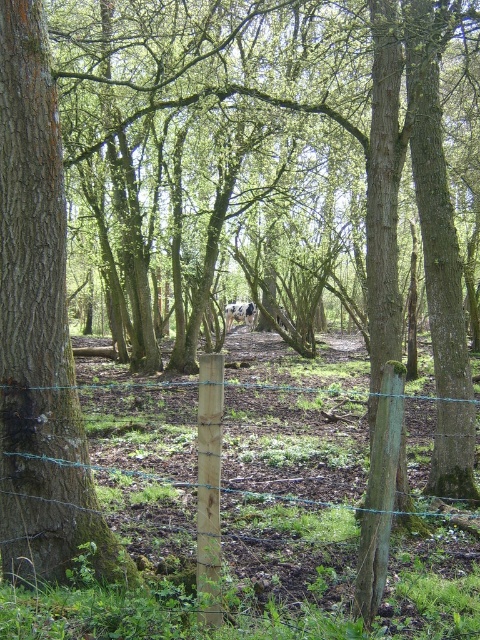
Is green wire fence at center smaller than rough bark tree at center?

Incorrect, green wire fence at center is not smaller in size than rough bark tree at center.

Is point (282, 573) closer to viewer compared to point (47, 460)?

No.

Is point (355, 563) positioned in front of point (12, 337)?

No, it is behind (12, 337).

Find the location of `green wire fence at center`. green wire fence at center is located at coordinates (219, 502).